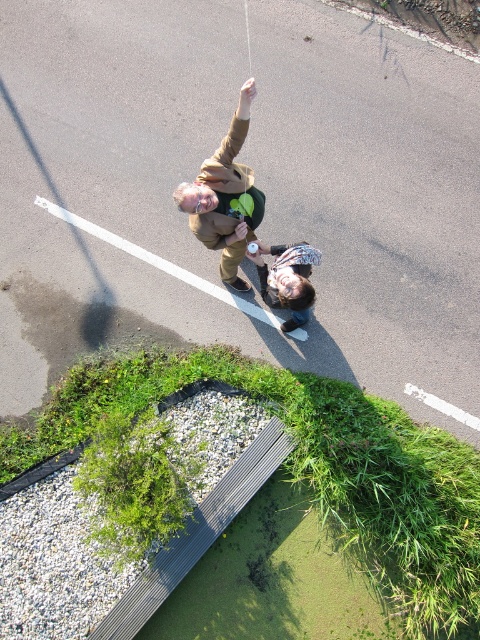
You are a drone operator trying to capture a photo of the brown suede jacket at upper center and the green grass at lower left. Based on the scene, which object is wider in the image?

The green grass at lower left might be wider than brown suede jacket at upper center.